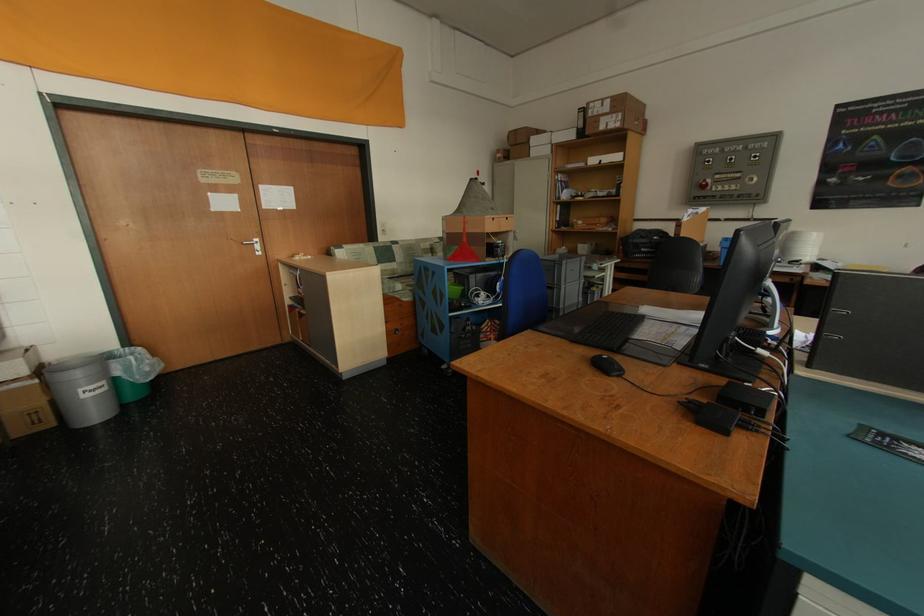
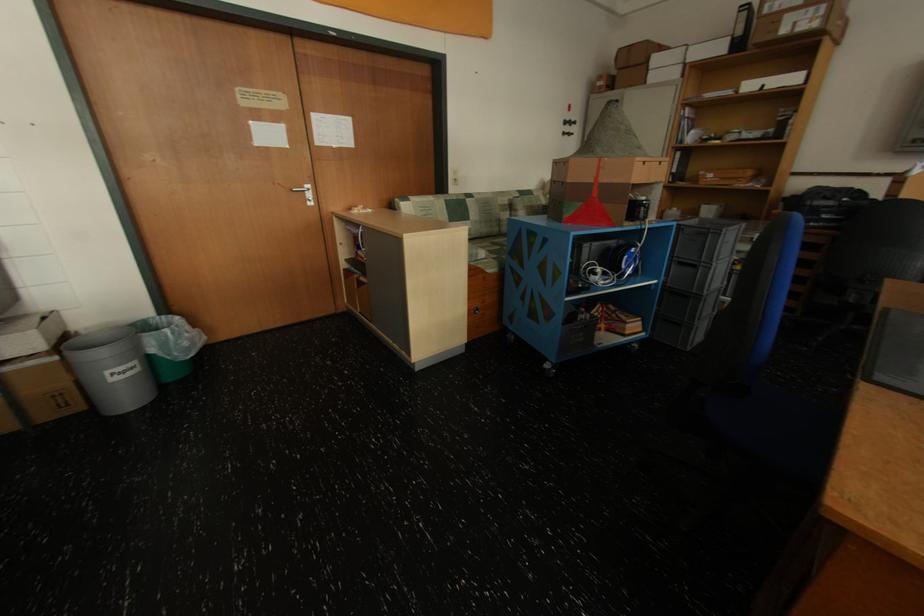
What movement of the cameraman would produce the second image?

The cameraman walked toward left, forward.